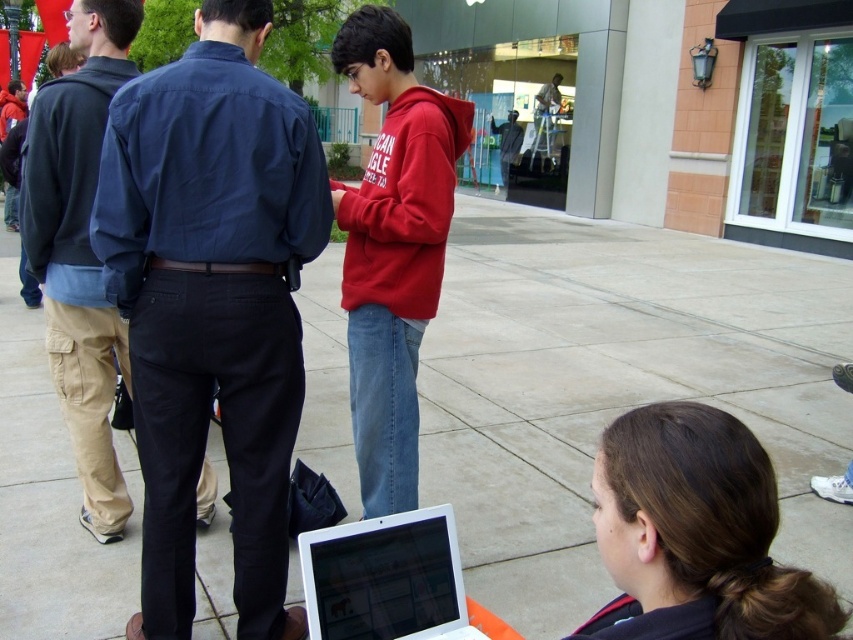
Does dark blue shirt at center have a lesser height compared to khaki cargo pants at left?

Correct, dark blue shirt at center is not as tall as khaki cargo pants at left.

Between dark blue shirt at center and khaki cargo pants at left, which one has more height?

Standing taller between the two is khaki cargo pants at left.

Which is in front, point (152, 145) or point (59, 228)?

Point (152, 145)

Find the location of `dark blue shirt at center`. dark blue shirt at center is located at coordinates coord(212,301).

Which is behind, point (587, 406) or point (33, 237)?

Positioned behind is point (587, 406).

Measure the distance between point [577,525] and camera.

Point [577,525] and camera are 11.23 feet apart from each other.

In order to click on smooth concrete pavement at center in this screenshot , I will do `click(616, 387)`.

This screenshot has height=640, width=853. In order to click on smooth concrete pavement at center in this screenshot , I will do (x=616, y=387).

Is brown hair at lower right to the left of white glossy laptop at lower right from the viewer's perspective?

No, brown hair at lower right is not to the left of white glossy laptop at lower right.

Can you confirm if brown hair at lower right is taller than white glossy laptop at lower right?

Correct, brown hair at lower right is much taller as white glossy laptop at lower right.

Which is behind, point (637, 595) or point (349, 611)?

The point (349, 611) is more distant.

At what (x,y) coordinates should I click in order to perform the action: click on brown hair at lower right. Please return your answer as a coordinate pair (x, y). The width and height of the screenshot is (853, 640). Looking at the image, I should click on (695, 532).